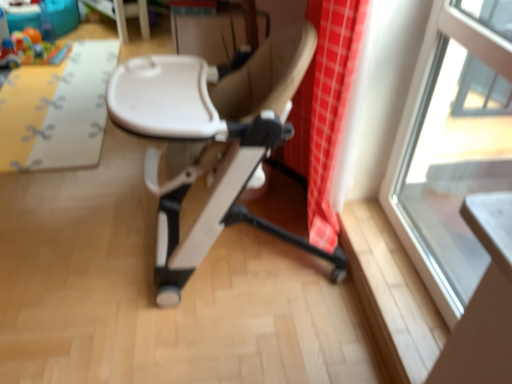
Question: From a real-world perspective, is white glossy table at upper center positioned above or below yellow fabric mat at upper left?

Choices:
 (A) above
 (B) below

Answer: (A)

Question: Is white glossy table at upper center situated inside yellow fabric mat at upper left or outside?

Choices:
 (A) outside
 (B) inside

Answer: (A)

Question: Estimate the real-world distances between objects in this image. Which object is farther from the rubberized plastic toy at upper left?

Choices:
 (A) beige leather chair at center
 (B) yellow fabric mat at upper left
 (C) white glossy table at upper center
 (D) transparent glass window at upper right

Answer: (D)

Question: Which is farther from the transparent glass window at upper right?

Choices:
 (A) yellow fabric mat at upper left
 (B) white glossy table at upper center
 (C) rubberized plastic toy at upper left
 (D) beige leather chair at center

Answer: (C)